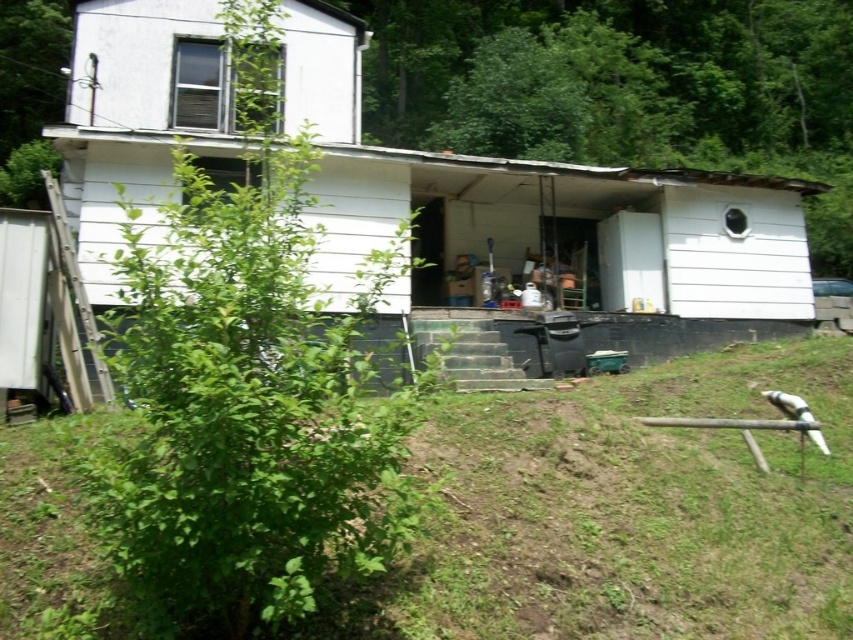
You are standing in front of the house and want to determine the distance between two points marked on the house. The first point is at coordinates point (202, 506) and the second point is at point (691, 193). Which point is closer to you?

Point (202, 506) is closer to the camera than point (691, 193), so the first point is closer to you.

You are standing in front of the house and want to walk from the green grass at lower left to the green leafy bush at center. Which direction should you move to get closer to the bush?

To get closer to the green leafy bush at center, you should move away from the green grass at lower left since the grass is closer to you than the bush. Moving towards the center of the scene would bring you nearer to the bush.